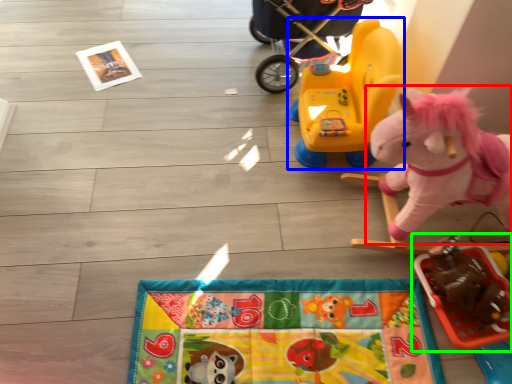
Question: Which is farther away from toy (highlighted by a red box)? toy (highlighted by a blue box) or toy (highlighted by a green box)?

Choices:
 (A) toy
 (B) toy

Answer: (A)